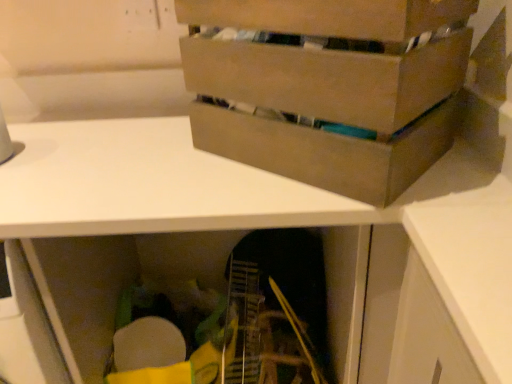
Question: Is brown cardboard box at upper center smaller than white matte desk at center?

Choices:
 (A) yes
 (B) no

Answer: (A)

Question: Is brown cardboard box at upper center at the left side of white matte desk at center?

Choices:
 (A) yes
 (B) no

Answer: (B)

Question: Is brown cardboard box at upper center oriented towards white matte desk at center?

Choices:
 (A) no
 (B) yes

Answer: (A)

Question: Can white matte desk at center be found inside brown cardboard box at upper center?

Choices:
 (A) no
 (B) yes

Answer: (A)

Question: Are brown cardboard box at upper center and white matte desk at center making contact?

Choices:
 (A) yes
 (B) no

Answer: (B)

Question: Is brown cardboard box at upper center to the right of white matte desk at center from the viewer's perspective?

Choices:
 (A) no
 (B) yes

Answer: (B)

Question: Considering the relative sizes of white matte desk at center and brown cardboard box at upper center in the image provided, is white matte desk at center shorter than brown cardboard box at upper center?

Choices:
 (A) yes
 (B) no

Answer: (B)

Question: Considering the relative positions of white matte desk at center and brown cardboard box at upper center in the image provided, is white matte desk at center to the right of brown cardboard box at upper center from the viewer's perspective?

Choices:
 (A) yes
 (B) no

Answer: (B)

Question: Is white matte desk at center directly adjacent to brown cardboard box at upper center?

Choices:
 (A) no
 (B) yes

Answer: (A)

Question: Is the depth of white matte desk at center greater than that of brown cardboard box at upper center?

Choices:
 (A) yes
 (B) no

Answer: (A)

Question: Is white matte desk at center positioned far away from brown cardboard box at upper center?

Choices:
 (A) no
 (B) yes

Answer: (A)

Question: Is brown cardboard box at upper center located within white matte desk at center?

Choices:
 (A) no
 (B) yes

Answer: (A)

Question: From the image's perspective, relative to brown cardboard box at upper center, is white matte desk at center above or below?

Choices:
 (A) above
 (B) below

Answer: (B)